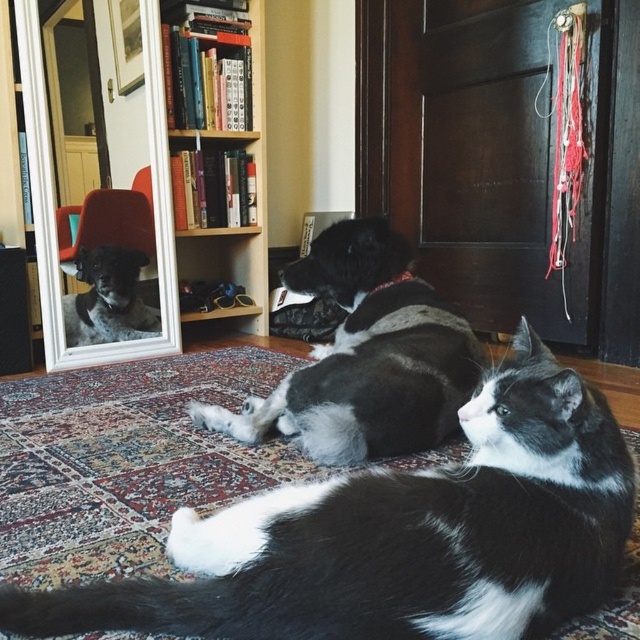
Does black and white fur at center appear under wooden bookshelf at upper center?

Indeed, black and white fur at center is positioned under wooden bookshelf at upper center.

Who is more distant from viewer, (349, 230) or (259, 140)?

Positioned behind is point (259, 140).

Where is `black and white fur at center`? black and white fur at center is located at coordinates (365, 356).

What do you see at coordinates (220, 161) in the screenshot? The image size is (640, 640). I see `wooden bookshelf at upper center` at bounding box center [220, 161].

Can you confirm if wooden bookshelf at upper center is bigger than white-framed mirror at upper left?

Yes.

Which is in front, point (234, 237) or point (154, 193)?

Point (154, 193)

At what (x,y) coordinates should I click in order to perform the action: click on wooden bookshelf at upper center. Please return your answer as a coordinate pair (x, y). Image resolution: width=640 pixels, height=640 pixels. Looking at the image, I should click on (220, 161).

Does black and white fur cat at center appear on the right side of wooden bookshelf at upper center?

Yes, black and white fur cat at center is to the right of wooden bookshelf at upper center.

Does black and white fur cat at center appear under wooden bookshelf at upper center?

Indeed, black and white fur cat at center is positioned under wooden bookshelf at upper center.

Between point (544, 403) and point (218, 317), which one is positioned behind?

The point (218, 317) is behind.

The height and width of the screenshot is (640, 640). I want to click on black and white fur cat at center, so click(397, 536).